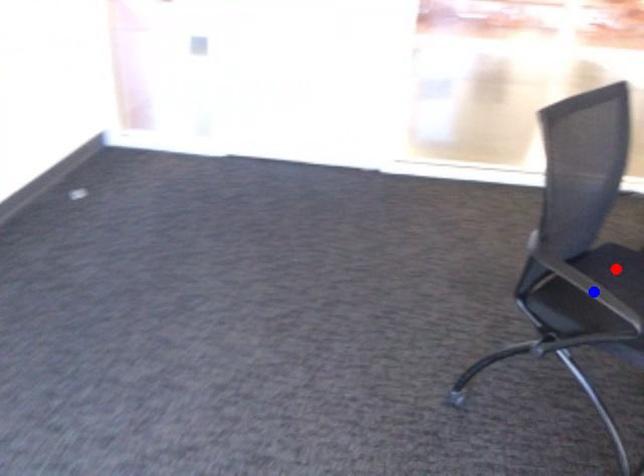
Question: Two points are marked on the image. Which point is closer to the camera?

Choices:
 (A) Blue point is closer.
 (B) Red point is closer.

Answer: (A)